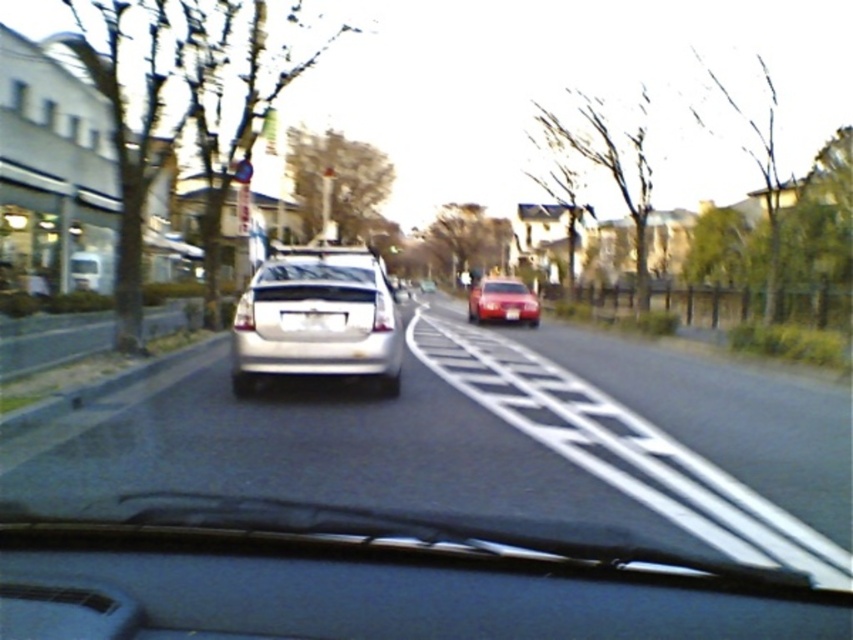
Does satin silver sedan at center have a larger size compared to white glossy license plate at center?

Yes.

Is point (349, 316) closer to camera compared to point (517, 314)?

Yes.

What do you see at coordinates (317, 317) in the screenshot? I see `satin silver sedan at center` at bounding box center [317, 317].

The height and width of the screenshot is (640, 853). I want to click on satin silver sedan at center, so click(317, 317).

Who is positioned more to the right, white plastic license plate at center or white glossy license plate at center?

From the viewer's perspective, white glossy license plate at center appears more on the right side.

Image resolution: width=853 pixels, height=640 pixels. In order to click on white plastic license plate at center in this screenshot , I will do `click(312, 321)`.

Does shiny red car at center have a smaller size compared to white glossy license plate at center?

Incorrect, shiny red car at center is not smaller in size than white glossy license plate at center.

Does shiny red car at center have a greater height compared to white glossy license plate at center?

Indeed, shiny red car at center has a greater height compared to white glossy license plate at center.

Which is in front, point (537, 323) or point (511, 308)?

Positioned in front is point (511, 308).

Image resolution: width=853 pixels, height=640 pixels. Find the location of `shiny red car at center`. shiny red car at center is located at coordinates click(502, 300).